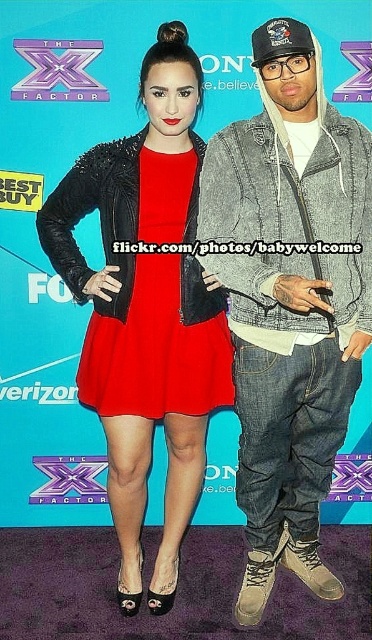
Does denim jacket at center appear on the left side of matte red dress at center?

In fact, denim jacket at center is to the right of matte red dress at center.

Does denim jacket at center have a lesser height compared to matte red dress at center?

Incorrect, denim jacket at center's height does not fall short of matte red dress at center's.

Locate an element on the screen. This screenshot has height=640, width=372. denim jacket at center is located at coordinates (290, 300).

Between denim jacket at center and matte black dress at center, which one is positioned higher?

matte black dress at center is above.

Can you confirm if denim jacket at center is taller than matte black dress at center?

Incorrect, denim jacket at center's height is not larger of matte black dress at center's.

Measure the distance between denim jacket at center and camera.

A distance of 5.93 feet exists between denim jacket at center and camera.

The width and height of the screenshot is (372, 640). I want to click on denim jacket at center, so click(x=290, y=300).

Who is taller, matte black dress at center or matte red dress at center?

Standing taller between the two is matte black dress at center.

Which is more to the right, matte black dress at center or matte red dress at center?

matte red dress at center is more to the right.

Who is more forward, (216,397) or (165,198)?

Positioned in front is point (165,198).

This screenshot has height=640, width=372. Find the location of `matte black dress at center`. matte black dress at center is located at coordinates (146, 308).